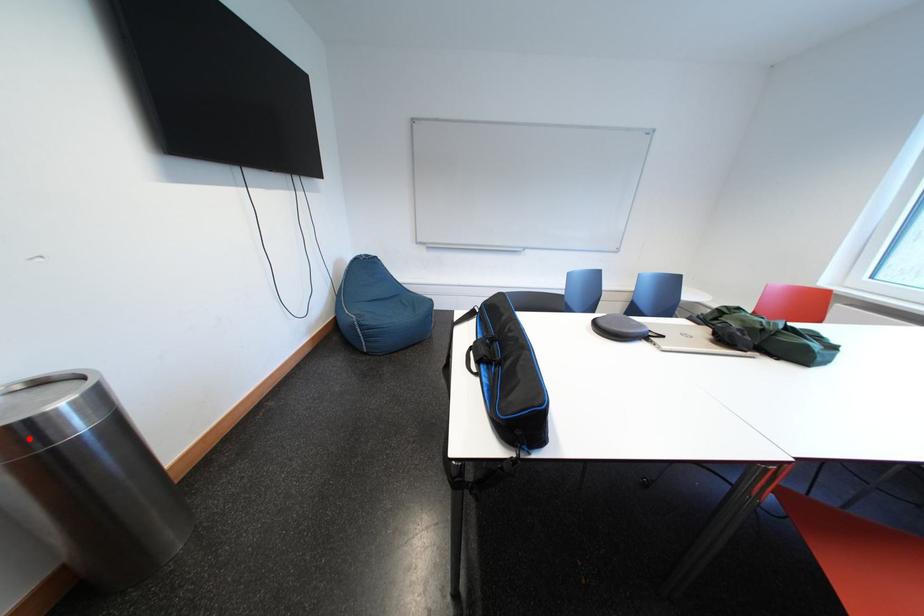
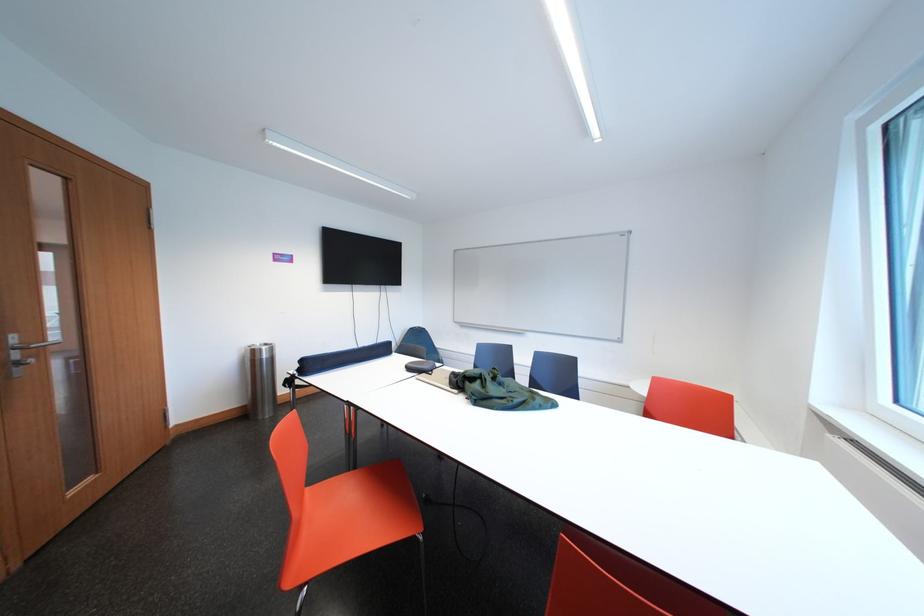
In the second image, find the point that corresponds to the highlighted location in the first image.

(263, 357)